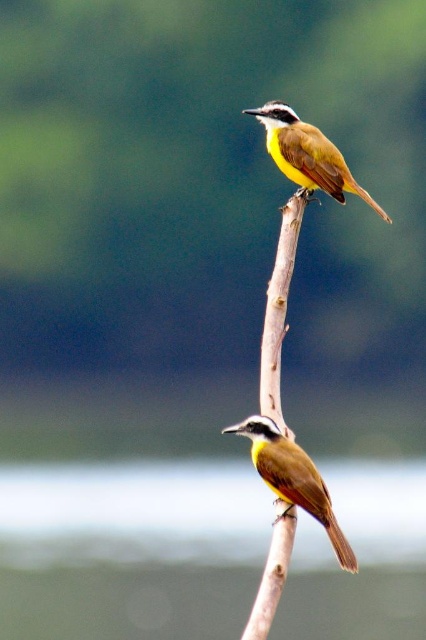
Which of these two, brown wood at center or brown matte bird at center, stands taller?

brown wood at center is taller.

Is point (255, 618) in front of point (279, 499)?

Yes, it is in front of point (279, 499).

At what (x,y) coordinates should I click in order to perform the action: click on brown wood at center. Please return your answer as a coordinate pair (x, y). The width and height of the screenshot is (426, 640). Looking at the image, I should click on (279, 310).

This screenshot has width=426, height=640. Find the location of `brown wood at center`. brown wood at center is located at coordinates tap(279, 310).

Which is above, brown wood at center or brown feathered bird at upper center?

Positioned higher is brown feathered bird at upper center.

Does point (282, 326) come behind point (339, 161)?

No.

The width and height of the screenshot is (426, 640). Find the location of `brown wood at center`. brown wood at center is located at coordinates (279, 310).

Is point (285, 513) farther from viewer compared to point (255, 108)?

No.

Can you confirm if brown matte bird at center is taller than brown feathered bird at upper center?

Incorrect, brown matte bird at center's height is not larger of brown feathered bird at upper center's.

Is point (331, 529) less distant than point (287, 166)?

Yes, it is.

Where is `brown matte bird at center`? This screenshot has width=426, height=640. brown matte bird at center is located at coordinates (293, 480).